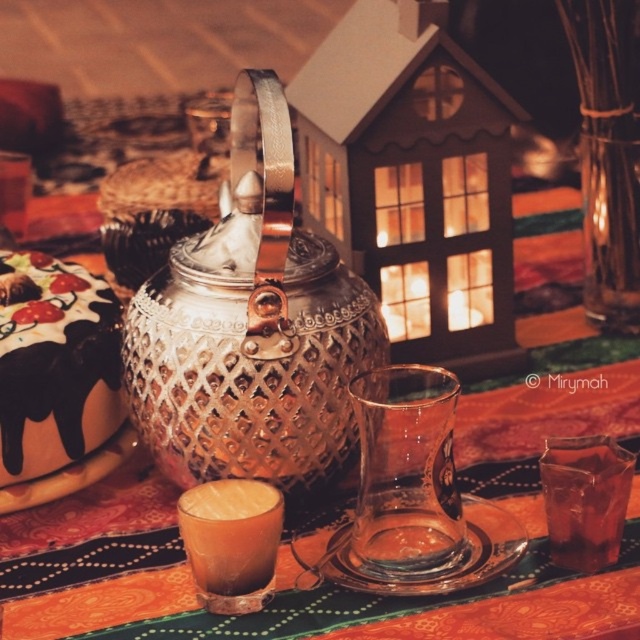
You are standing at the entrance of the room and want to pour yourself a drink from the polished copper teapot at center. In which direction should you move relative to your current position to reach it?

You should move towards the center of the room to reach the polished copper teapot at center, as it is located at point coordinates of (250, 326).

Based on the photo, you are a person with an arm length of 24 inches. You want to reach the transparent glass at center from your current position. Can you reach it without moving your feet?

The transparent glass at center is 12.71 inches from camera, so yes, you can reach it with your arm length of 24 inches since it is within your reach.